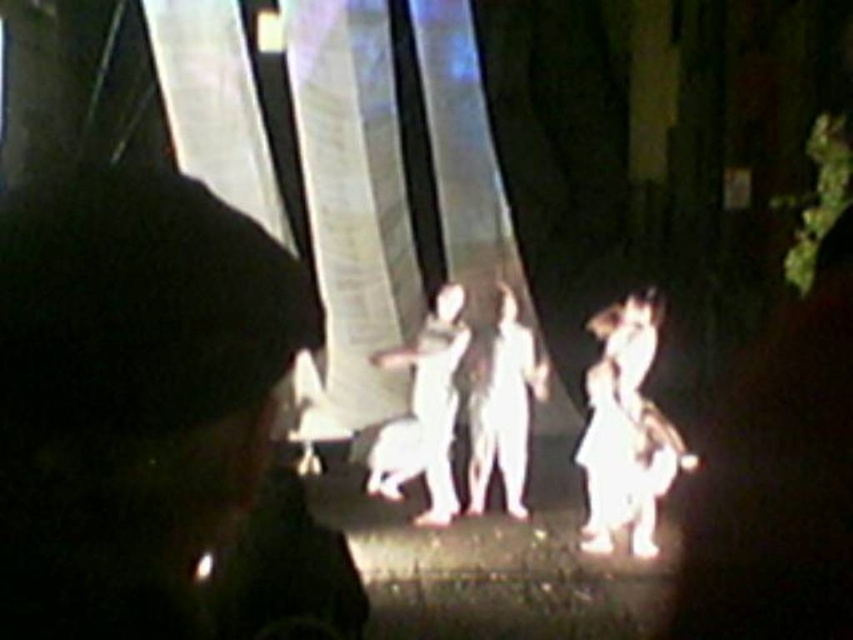
Is smooth black shirt at center further to the viewer compared to white matte figure at center?

No, it is not.

Is smooth black shirt at center thinner than white matte figure at center?

Correct, smooth black shirt at center's width is less than white matte figure at center's.

At what (x,y) coordinates should I click in order to perform the action: click on smooth black shirt at center. Please return your answer as a coordinate pair (x, y). The width and height of the screenshot is (853, 640). Looking at the image, I should click on (151, 419).